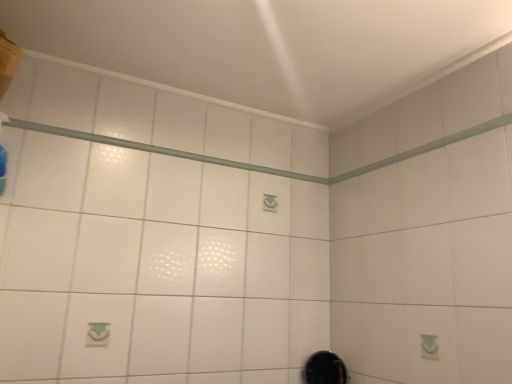
Question: Does black glossy mirror at lower right have a larger size compared to white glossy shower at upper center?

Choices:
 (A) no
 (B) yes

Answer: (B)

Question: From a real-world perspective, is black glossy mirror at lower right on top of white glossy shower at upper center?

Choices:
 (A) yes
 (B) no

Answer: (B)

Question: From the image's perspective, would you say black glossy mirror at lower right is shown under white glossy shower at upper center?

Choices:
 (A) yes
 (B) no

Answer: (A)

Question: Can you confirm if black glossy mirror at lower right is taller than white glossy shower at upper center?

Choices:
 (A) yes
 (B) no

Answer: (A)

Question: Is black glossy mirror at lower right wider than white glossy shower at upper center?

Choices:
 (A) yes
 (B) no

Answer: (A)

Question: Is the position of black glossy mirror at lower right less distant than that of white glossy shower at upper center?

Choices:
 (A) no
 (B) yes

Answer: (A)

Question: Is white glossy shower at upper center closer to camera compared to black glossy mirror at lower right?

Choices:
 (A) no
 (B) yes

Answer: (B)

Question: From the image's perspective, does white glossy shower at upper center appear lower than black glossy mirror at lower right?

Choices:
 (A) yes
 (B) no

Answer: (B)

Question: Can you confirm if white glossy shower at upper center is bigger than black glossy mirror at lower right?

Choices:
 (A) no
 (B) yes

Answer: (A)

Question: Considering the relative sizes of white glossy shower at upper center and black glossy mirror at lower right in the image provided, is white glossy shower at upper center wider than black glossy mirror at lower right?

Choices:
 (A) yes
 (B) no

Answer: (B)

Question: Is white glossy shower at upper center aimed at black glossy mirror at lower right?

Choices:
 (A) yes
 (B) no

Answer: (B)

Question: Is white glossy shower at upper center next to black glossy mirror at lower right and touching it?

Choices:
 (A) no
 (B) yes

Answer: (A)

Question: In terms of height, does black glossy mirror at lower right look taller or shorter compared to white glossy shower at upper center?

Choices:
 (A) tall
 (B) short

Answer: (A)